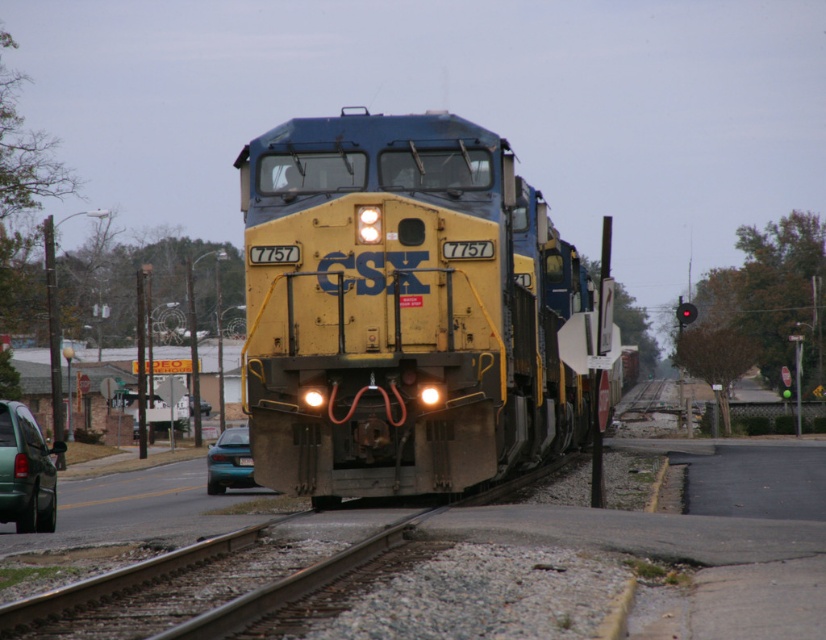
Question: Can you confirm if green matte van at lower left is smaller than teal glossy car at lower left?

Choices:
 (A) no
 (B) yes

Answer: (B)

Question: Which object is the farthest from the teal glossy car at lower left?

Choices:
 (A) yellow matte locomotive at center
 (B) green matte van at lower left

Answer: (B)

Question: Based on their relative distances, which object is farther from the yellow matte locomotive at center?

Choices:
 (A) green matte van at lower left
 (B) teal glossy car at lower left

Answer: (A)

Question: Does green matte van at lower left have a lesser width compared to teal glossy car at lower left?

Choices:
 (A) yes
 (B) no

Answer: (A)

Question: Which of the following is the closest to the observer?

Choices:
 (A) yellow matte locomotive at center
 (B) teal glossy car at lower left
 (C) green matte van at lower left

Answer: (A)

Question: In this image, where is green matte van at lower left located relative to teal glossy car at lower left?

Choices:
 (A) above
 (B) below

Answer: (A)